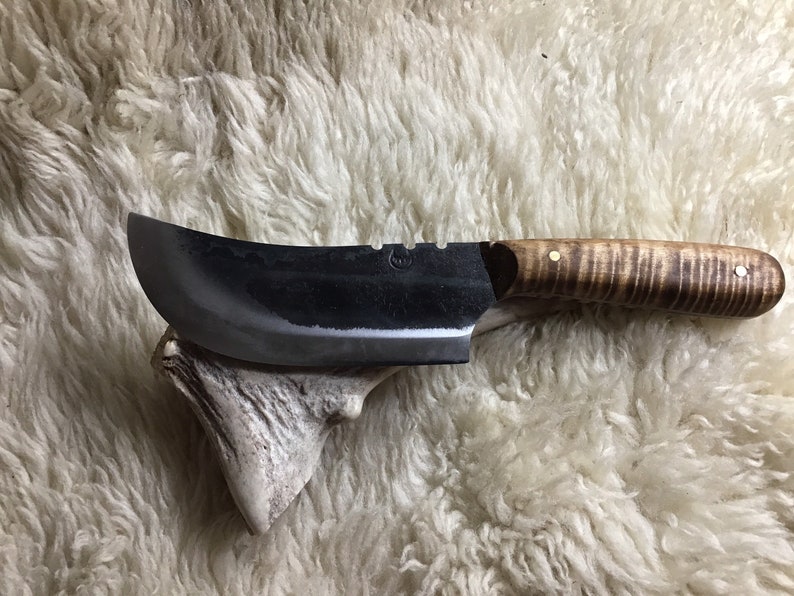
In order to click on metal screws in this screenshot , I will do `click(742, 269)`.